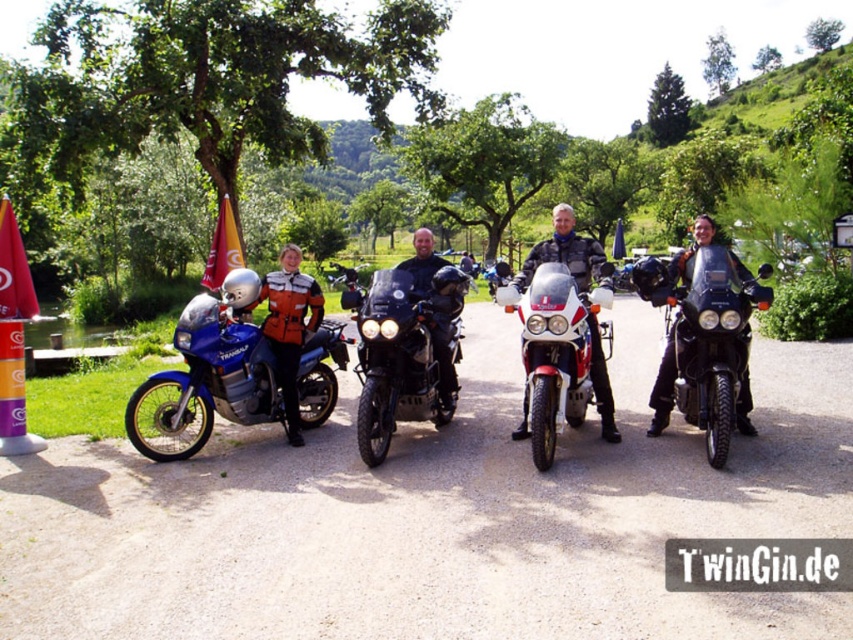
Question: Which object appears farthest from the camera in this image?

Choices:
 (A) shiny black motorcycle at right
 (B) red matte sportbike at center
 (C) matte black motorcycle at center
 (D) orange leather jacket at left

Answer: (D)

Question: Can you confirm if orange leather jacket at left is smaller than matte black motorcycle at center?

Choices:
 (A) yes
 (B) no

Answer: (A)

Question: Considering the relative positions of matte blue motorcycle at left and red matte sportbike at center in the image provided, where is matte blue motorcycle at left located with respect to red matte sportbike at center?

Choices:
 (A) left
 (B) right

Answer: (A)

Question: Does orange leather jacket at left have a larger size compared to matte black motorcycle at center?

Choices:
 (A) no
 (B) yes

Answer: (A)

Question: Estimate the real-world distances between objects in this image. Which object is farther from the shiny black motorcycle at right?

Choices:
 (A) red matte sportbike at center
 (B) matte blue motorcycle at left
 (C) shiny black motorcycle at center

Answer: (B)

Question: Which of the following is the farthest from the observer?

Choices:
 (A) (389, 273)
 (B) (734, 273)
 (C) (569, 292)
 (D) (142, 419)

Answer: (A)